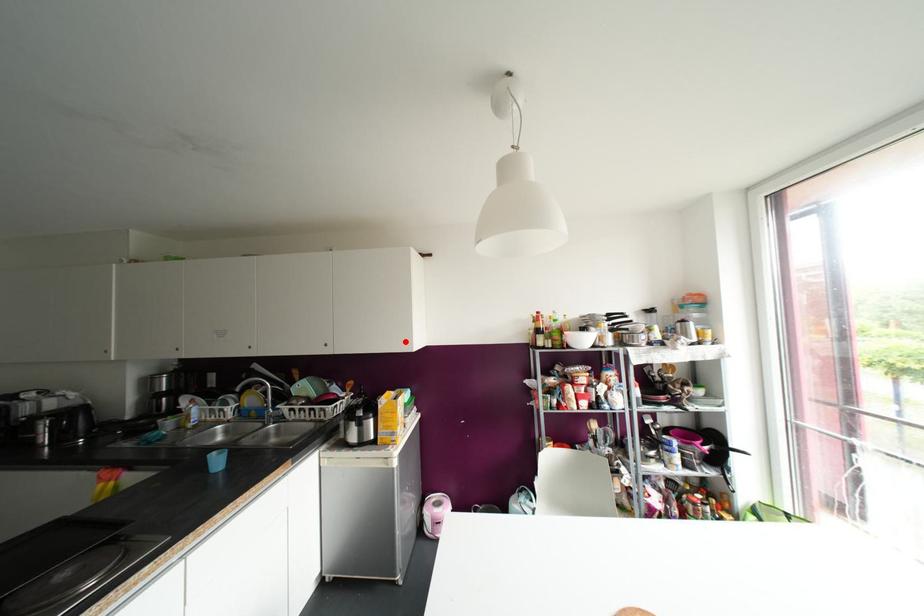
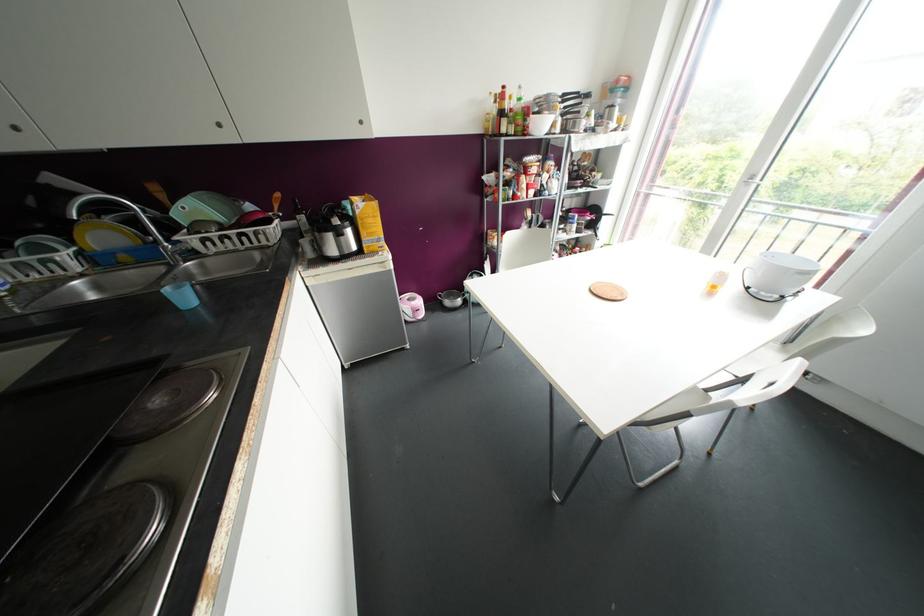
Locate, in the second image, the point that corresponds to the highlighted location in the first image.

(360, 122)